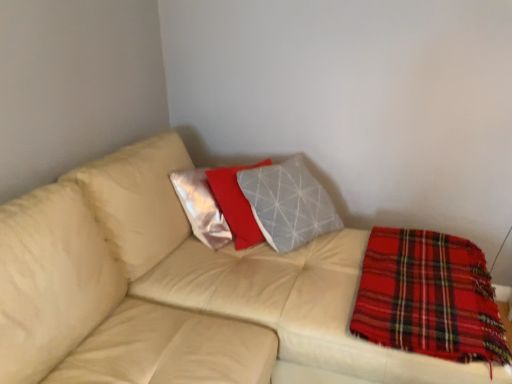
In order to face red plaid blanket at lower right, should I rotate leftwards or rightwards?

You should rotate right by 21.739 degrees.

Where is `red plaid blanket at lower right`? red plaid blanket at lower right is located at coordinates (428, 297).

The image size is (512, 384). Describe the element at coordinates (428, 297) in the screenshot. I see `red plaid blanket at lower right` at that location.

This screenshot has height=384, width=512. What do you see at coordinates (173, 289) in the screenshot? I see `beige leather couch at center` at bounding box center [173, 289].

Image resolution: width=512 pixels, height=384 pixels. Find the location of `beige leather couch at center`. beige leather couch at center is located at coordinates (173, 289).

At what (x,y) coordinates should I click in order to perform the action: click on red plaid blanket at lower right. Please return your answer as a coordinate pair (x, y). This screenshot has width=512, height=384. Looking at the image, I should click on (428, 297).

From the picture: Considering the relative positions of red plaid blanket at lower right and beige leather couch at center in the image provided, is red plaid blanket at lower right to the left or to the right of beige leather couch at center?

In the image, red plaid blanket at lower right appears on the right side of beige leather couch at center.

Between red plaid blanket at lower right and beige leather couch at center, which one is positioned in front?

beige leather couch at center is in front.

Considering the positions of point (473, 330) and point (163, 380), is point (473, 330) closer or farther from the camera than point (163, 380)?

Point (473, 330) appears to be farther away from the viewer than point (163, 380).

From the image's perspective, between red plaid blanket at lower right and beige leather couch at center, which one is located above?

beige leather couch at center appears higher in the image.

From a real-world perspective, who is located higher, red plaid blanket at lower right or beige leather couch at center?

In real-world perspective, red plaid blanket at lower right is above.

Between red plaid blanket at lower right and beige leather couch at center, which one has smaller width?

With smaller width is red plaid blanket at lower right.

Is red plaid blanket at lower right shorter than beige leather couch at center?

Correct, red plaid blanket at lower right is not as tall as beige leather couch at center.

Does red plaid blanket at lower right have a larger size compared to beige leather couch at center?

No, red plaid blanket at lower right is not bigger than beige leather couch at center.

Is red plaid blanket at lower right completely or partially outside of beige leather couch at center?

No, most part of red plaid blanket at lower right lies within beige leather couch at center.

Is red plaid blanket at lower right touching beige leather couch at center?

No, red plaid blanket at lower right is not touching beige leather couch at center.

Is red plaid blanket at lower right oriented towards beige leather couch at center?

Yes, red plaid blanket at lower right faces towards beige leather couch at center.

How different are the orientations of red plaid blanket at lower right and beige leather couch at center in degrees?

0.00043 degrees separate the facing orientations of red plaid blanket at lower right and beige leather couch at center.

Where is `blanket behind the beige leather couch at center`? The height and width of the screenshot is (384, 512). blanket behind the beige leather couch at center is located at coordinates (428, 297).

Does beige leather couch at center appear on the left side of red plaid blanket at lower right?

Correct, you'll find beige leather couch at center to the left of red plaid blanket at lower right.

Which object is more forward, beige leather couch at center or red plaid blanket at lower right?

Positioned in front is beige leather couch at center.

Does point (343, 345) come behind point (416, 330)?

Yes, it is.

From the image's perspective, who appears lower, beige leather couch at center or red plaid blanket at lower right?

From the image's view, red plaid blanket at lower right is below.

From a real-world perspective, who is located higher, beige leather couch at center or red plaid blanket at lower right?

red plaid blanket at lower right is physically above.

Does beige leather couch at center have a greater width compared to red plaid blanket at lower right?

Yes.

Considering the sizes of objects beige leather couch at center and red plaid blanket at lower right in the image provided, who is shorter, beige leather couch at center or red plaid blanket at lower right?

Standing shorter between the two is red plaid blanket at lower right.

Which of these two, beige leather couch at center or red plaid blanket at lower right, is smaller?

red plaid blanket at lower right is smaller.

Does beige leather couch at center contain red plaid blanket at lower right?

Yes.

Based on the photo, can you see beige leather couch at center touching red plaid blanket at lower right?

No, beige leather couch at center is not making contact with red plaid blanket at lower right.

Based on the photo, is beige leather couch at center facing away from red plaid blanket at lower right?

No, beige leather couch at center is not facing the opposite direction of red plaid blanket at lower right.

How much distance is there between beige leather couch at center and red plaid blanket at lower right?

beige leather couch at center is 17.02 inches away from red plaid blanket at lower right.

Find the location of a particular element. This screenshot has width=512, height=384. studio couch below the red plaid blanket at lower right (from a real-world perspective) is located at coordinates (173, 289).

Identify the location of studio couch directly beneath the red plaid blanket at lower right (from a real-world perspective). Image resolution: width=512 pixels, height=384 pixels. (173, 289).

In the image, there is a beige leather couch at center. Identify the location of blanket below it (from the image's perspective). This screenshot has width=512, height=384. 428,297.